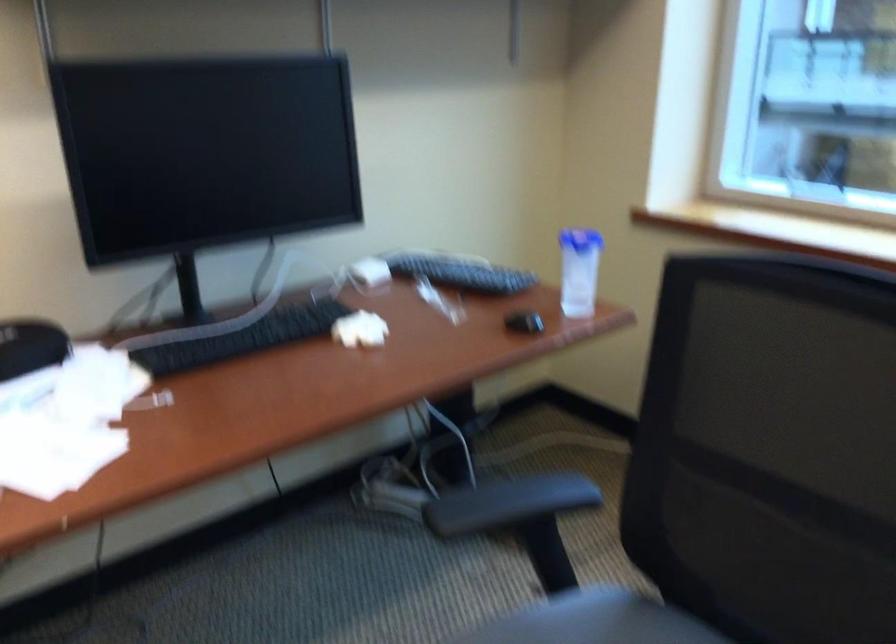
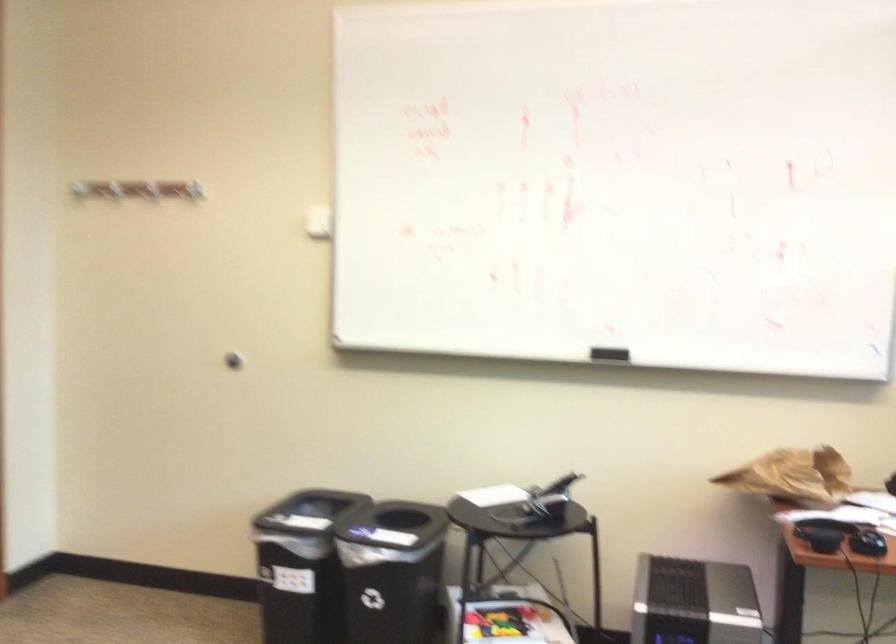
Question: The camera is either moving clockwise (left) or counter-clockwise (right) around the object. The first image is from the beginning of the video and the second image is from the end. Is the camera moving left or right when shooting the video?

Choices:
 (A) Left
 (B) Right

Answer: (B)